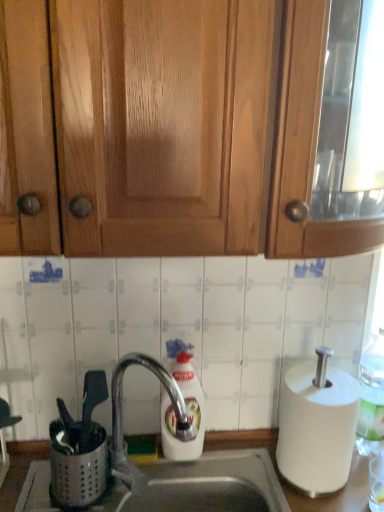
Describe the element at coordinates (317, 428) in the screenshot. This screenshot has height=512, width=384. I see `white matte paper towel at right` at that location.

The image size is (384, 512). What do you see at coordinates (190, 127) in the screenshot?
I see `wooden cabinet at upper center` at bounding box center [190, 127].

This screenshot has width=384, height=512. Describe the element at coordinates (122, 418) in the screenshot. I see `satin chrome faucet at center` at that location.

The image size is (384, 512). Describe the element at coordinates (371, 399) in the screenshot. I see `white plastic bottle at right` at that location.

Describe the element at coordinates (185, 406) in the screenshot. I see `white glossy soap dispenser at center` at that location.

Identify the location of white glossy soap dispenser at center. (185, 406).

Locate an element on the screen. metallic stainless steel sink at lower center is located at coordinates (293, 486).

Consider the image. From the image's perspective, between wooden cabinet at upper center and white matte paper towel at right, who is located below?

white matte paper towel at right.

Can you confirm if wooden cabinet at upper center is shorter than white matte paper towel at right?

No.

Is the surface of wooden cabinet at upper center in direct contact with white matte paper towel at right?

wooden cabinet at upper center and white matte paper towel at right are clearly separated.

Is wooden cabinet at upper center behind white plastic bottle at right?

No, it is in front of white plastic bottle at right.

Can you confirm if wooden cabinet at upper center is shorter than white plastic bottle at right?

No, wooden cabinet at upper center is not shorter than white plastic bottle at right.

Does wooden cabinet at upper center have a greater width compared to white plastic bottle at right?

Yes, wooden cabinet at upper center is wider than white plastic bottle at right.

Which of these two, wooden cabinet at upper center or white plastic bottle at right, is bigger?

wooden cabinet at upper center.

From the picture: How far apart are metallic stainless steel sink at lower center and satin chrome faucet at center?

metallic stainless steel sink at lower center is 20.95 centimeters from satin chrome faucet at center.

Looking at this image, considering the positions of objects metallic stainless steel sink at lower center and satin chrome faucet at center in the image provided, who is in front, metallic stainless steel sink at lower center or satin chrome faucet at center?

satin chrome faucet at center is in front.

Is metallic stainless steel sink at lower center to the right of satin chrome faucet at center from the viewer's perspective?

Yes, metallic stainless steel sink at lower center is to the right of satin chrome faucet at center.

Is metallic stainless steel sink at lower center aimed at satin chrome faucet at center?

No.

Can you confirm if metallic stainless steel sink at lower center is smaller than white glossy soap dispenser at center?

No, metallic stainless steel sink at lower center is not smaller than white glossy soap dispenser at center.

From the image's perspective, which object appears higher, metallic stainless steel sink at lower center or white glossy soap dispenser at center?

From the image's view, white glossy soap dispenser at center is above.

Is metallic stainless steel sink at lower center taller than white glossy soap dispenser at center?

Incorrect, the height of metallic stainless steel sink at lower center is not larger of that of white glossy soap dispenser at center.

From a real-world perspective, is metallic stainless steel sink at lower center physically above white glossy soap dispenser at center?

No, from a real-world perspective, metallic stainless steel sink at lower center is not above white glossy soap dispenser at center.

From a real-world perspective, relative to satin chrome faucet at center, is white matte paper towel at right vertically above or below?

Clearly, from a real-world perspective, white matte paper towel at right is below satin chrome faucet at center.

Can you see white matte paper towel at right touching satin chrome faucet at center?

No, white matte paper towel at right is not in contact with satin chrome faucet at center.

Would you say white matte paper towel at right is outside satin chrome faucet at center?

Absolutely, white matte paper towel at right is external to satin chrome faucet at center.

From the image's perspective, is white matte paper towel at right above or below satin chrome faucet at center?

white matte paper towel at right is below satin chrome faucet at center.

From a real-world perspective, which object stands above the other?

In real-world perspective, wooden cabinet at upper center is above.

Considering the positions of objects satin chrome faucet at center and wooden cabinet at upper center in the image provided, who is behind, satin chrome faucet at center or wooden cabinet at upper center?

satin chrome faucet at center is further from the camera.

Based on their sizes in the image, would you say satin chrome faucet at center is bigger or smaller than wooden cabinet at upper center?

Clearly, satin chrome faucet at center is smaller in size than wooden cabinet at upper center.

Does satin chrome faucet at center have a greater height compared to wooden cabinet at upper center?

Incorrect, the height of satin chrome faucet at center is not larger of that of wooden cabinet at upper center.

Does point (371, 366) lie behind point (126, 366)?

Yes, it is behind point (126, 366).

Considering their positions, is white plastic bottle at right located in front of or behind satin chrome faucet at center?

white plastic bottle at right is behind satin chrome faucet at center.

Can you confirm if white plastic bottle at right is thinner than satin chrome faucet at center?

Correct, the width of white plastic bottle at right is less than that of satin chrome faucet at center.

Image resolution: width=384 pixels, height=512 pixels. What are the coordinates of `cabinetry in front of the white matte paper towel at right` in the screenshot? It's located at (190, 127).

This screenshot has width=384, height=512. In order to click on bottle below the wooden cabinet at upper center (from the image's perspective) in this screenshot , I will do `click(371, 399)`.

Based on their spatial positions, is metallic stainless steel sink at lower center or satin chrome faucet at center closer to white matte paper towel at right?

Among the two, metallic stainless steel sink at lower center is located nearer to white matte paper towel at right.

Looking at the image, which one is located further to white plastic bottle at right, white glossy soap dispenser at center or satin chrome faucet at center?

satin chrome faucet at center lies further to white plastic bottle at right than the other object.

From the image, which object appears to be farther from white matte paper towel at right, white plastic bottle at right or metallic stainless steel sink at lower center?

Among the two, metallic stainless steel sink at lower center is located further to white matte paper towel at right.

Considering their positions, is white plastic bottle at right positioned further to metallic stainless steel sink at lower center than wooden cabinet at upper center?

wooden cabinet at upper center is further to metallic stainless steel sink at lower center.

From the image, which object appears to be farther from white glossy soap dispenser at center, metallic stainless steel sink at lower center or white matte paper towel at right?

The object further to white glossy soap dispenser at center is white matte paper towel at right.

Which object lies nearer to the anchor point wooden cabinet at upper center, satin chrome faucet at center or metallic stainless steel sink at lower center?

Based on the image, satin chrome faucet at center appears to be nearer to wooden cabinet at upper center.

When comparing their distances from satin chrome faucet at center, does white glossy soap dispenser at center or white matte paper towel at right seem closer?

white glossy soap dispenser at center is closer to satin chrome faucet at center.

Estimate the real-world distances between objects in this image. Which object is further from satin chrome faucet at center, metallic stainless steel sink at lower center or white glossy soap dispenser at center?

Based on the image, metallic stainless steel sink at lower center appears to be further to satin chrome faucet at center.

In order to click on soap dispenser between satin chrome faucet at center and metallic stainless steel sink at lower center in the vertical direction in this screenshot , I will do `click(185, 406)`.

Locate an element on the screen. paper towel between wooden cabinet at upper center and metallic stainless steel sink at lower center in the vertical direction is located at coordinates (317, 428).

In order to click on paper towel between white glossy soap dispenser at center and white plastic bottle at right from left to right in this screenshot , I will do `click(317, 428)`.

Find the location of a particular element. This screenshot has height=512, width=384. soap dispenser between satin chrome faucet at center and white plastic bottle at right in the horizontal direction is located at coordinates (185, 406).